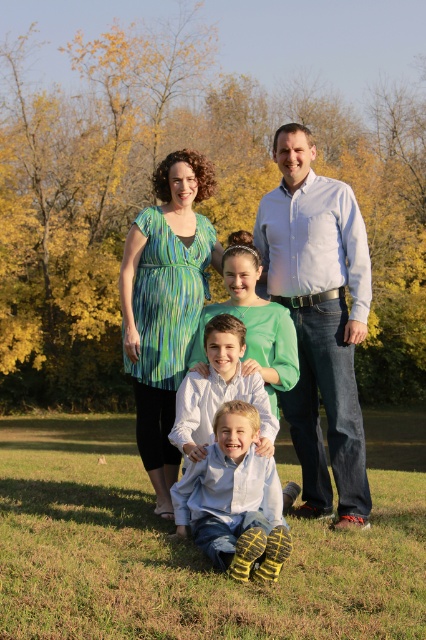
Is point (129, 552) positioned after point (187, 300)?

No.

Does green grass at lower center have a lesser width compared to green striped dress at upper left?

Incorrect, green grass at lower center's width is not less than green striped dress at upper left's.

Is point (63, 438) farther from viewer compared to point (154, 458)?

Yes.

Find the location of a particular element. The width and height of the screenshot is (426, 640). green grass at lower center is located at coordinates (193, 547).

You are a GUI agent. You are given a task and a screenshot of the screen. Output one action in this format:
    pyautogui.click(x=<x>, y=<y>)
    Task: Click on the matte green dress at center
    
    Given the screenshot: What is the action you would take?
    pyautogui.click(x=319, y=317)

Who is positioned more to the right, matte green dress at center or white shirt at upper center?

Positioned to the right is white shirt at upper center.

Between point (279, 243) and point (298, 177), which one is positioned behind?

Positioned behind is point (279, 243).

At what (x,y) coordinates should I click in order to perform the action: click on matte green dress at center. Please return your answer as a coordinate pair (x, y). The height and width of the screenshot is (640, 426). Looking at the image, I should click on (319, 317).

Can you confirm if white shirt at upper center is taller than white shirt at center?

Correct, white shirt at upper center is much taller as white shirt at center.

Can you confirm if white shirt at upper center is bigger than white shirt at center?

Yes, white shirt at upper center is bigger than white shirt at center.

Image resolution: width=426 pixels, height=640 pixels. Describe the element at coordinates (319, 320) in the screenshot. I see `white shirt at upper center` at that location.

Identify the location of white shirt at upper center. (319, 320).